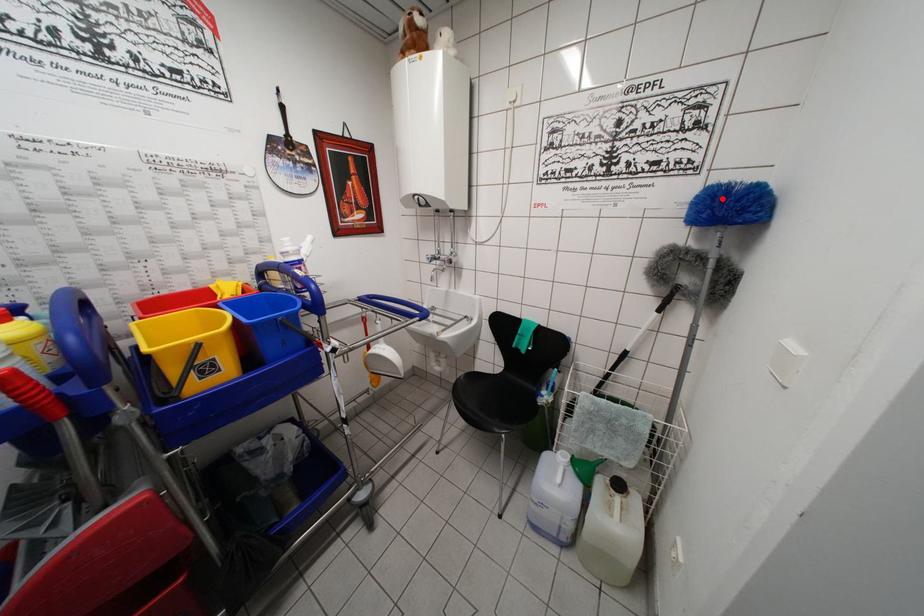
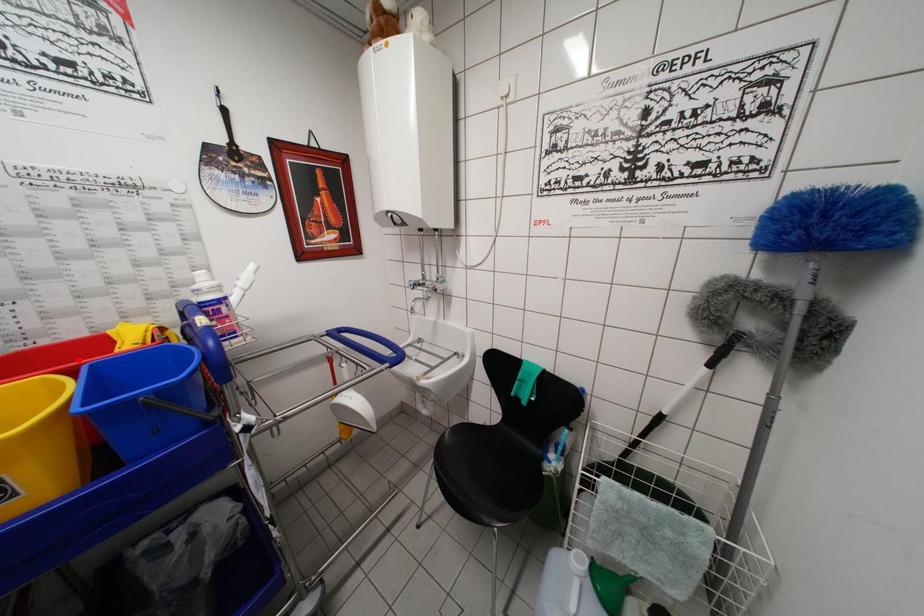
I am providing you with two images of the same scene from different viewpoints. A red point is marked on the first image and another point is marked on the second image. Are the points marked in image1 and image2 representing the same 3D position?

No